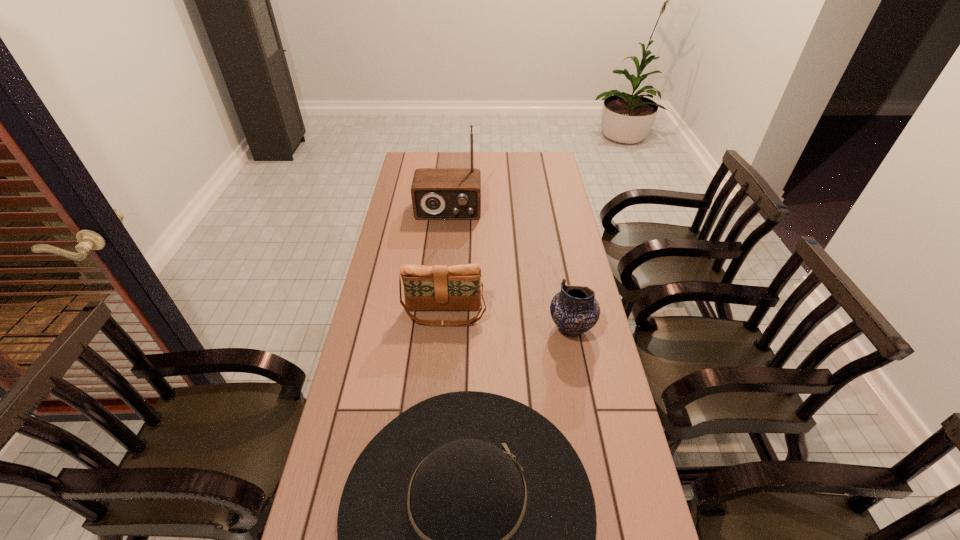
Where is `blank space that satisfies the following two spatial constraints: 1. on the front-facing side of the shoulder bag; 2. on the right side of the pottery`? This screenshot has height=540, width=960. blank space that satisfies the following two spatial constraints: 1. on the front-facing side of the shoulder bag; 2. on the right side of the pottery is located at coordinates (444, 328).

Find the location of a particular element. The height and width of the screenshot is (540, 960). blank space that satisfies the following two spatial constraints: 1. on the front-facing side of the radio receiver; 2. on the left side of the pottery is located at coordinates click(x=438, y=328).

Identify the location of free location that satisfies the following two spatial constraints: 1. on the front-facing side of the pottery; 2. on the right side of the radio receiver. The height and width of the screenshot is (540, 960). (438, 328).